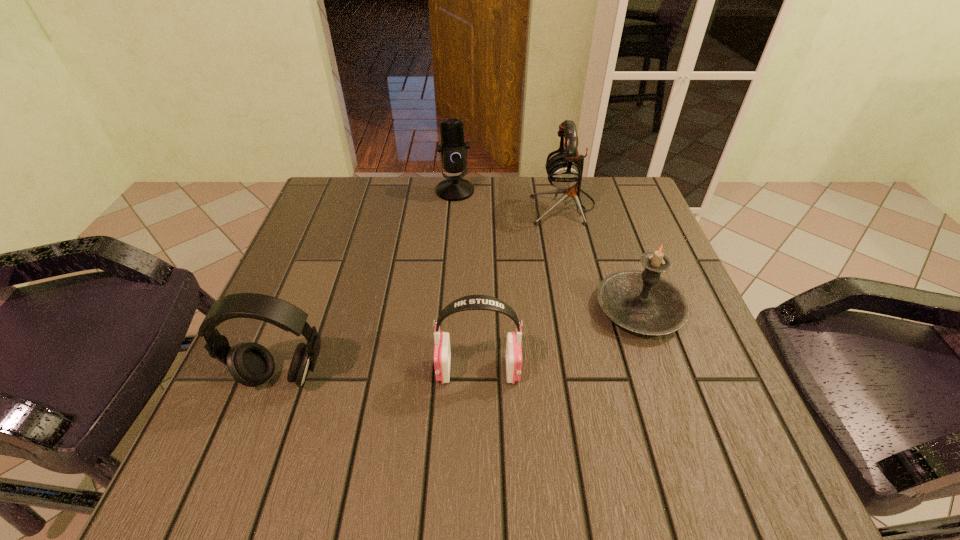
Locate an element on the screen. Image resolution: width=960 pixels, height=540 pixels. free space at the right edge of the desktop is located at coordinates (693, 348).

The height and width of the screenshot is (540, 960). What are the coordinates of `free location at the far right corner` in the screenshot? It's located at (626, 200).

Locate an element on the screen. The height and width of the screenshot is (540, 960). vacant space at the near right corner of the desktop is located at coordinates (689, 449).

Image resolution: width=960 pixels, height=540 pixels. Identify the location of empty space that is in between the leftmost earphone and the second earphone from left to right. (380, 374).

Where is `free space between the second earphone from right to left and the candle`? The width and height of the screenshot is (960, 540). free space between the second earphone from right to left and the candle is located at coordinates (559, 340).

Locate an element on the screen. empty location between the farthest earphone and the microphone is located at coordinates (509, 198).

This screenshot has width=960, height=540. What are the coordinates of `free space that is in between the microphone and the third farthest object` in the screenshot? It's located at (547, 249).

At what (x,y) coordinates should I click in order to perform the action: click on free spot between the third farthest object and the farthest earphone. Please return your answer as a coordinate pair (x, y). This screenshot has height=540, width=960. Looking at the image, I should click on (601, 257).

I want to click on free space between the microphone and the second earphone from left to right, so click(467, 281).

Locate an element on the screen. The height and width of the screenshot is (540, 960). vacant space in between the second earphone from right to left and the farthest earphone is located at coordinates (520, 288).